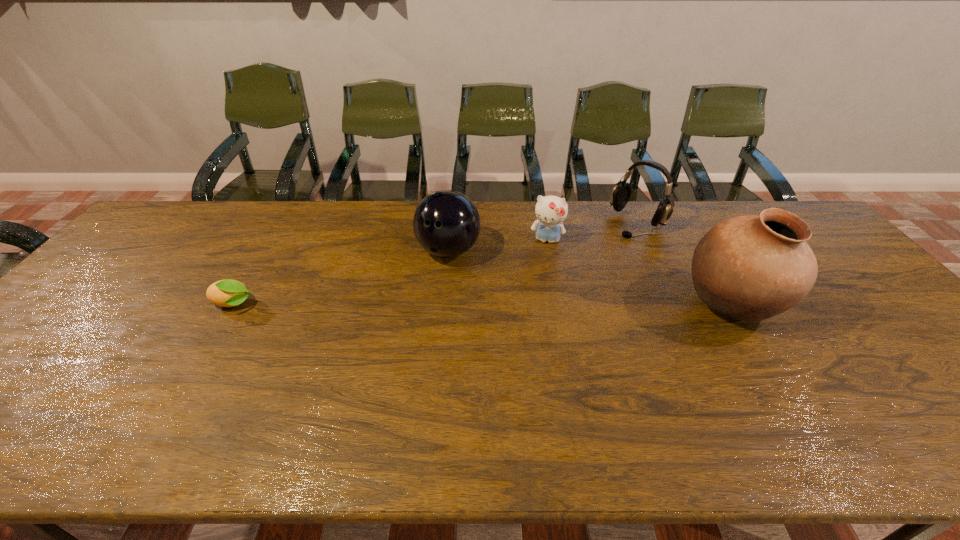
This screenshot has height=540, width=960. What are the coordinates of `bowling ball at the far edge` in the screenshot? It's located at (446, 223).

Where is `vacant region at the far edge of the desktop`? This screenshot has width=960, height=540. vacant region at the far edge of the desktop is located at coordinates (241, 218).

The height and width of the screenshot is (540, 960). Identify the location of vacant space at the near edge. (401, 377).

Where is `free space at the left edge`? free space at the left edge is located at coordinates (102, 272).

Find the location of a particular element. vacant position at the right edge of the desktop is located at coordinates (883, 301).

At what (x,y) coordinates should I click in order to perform the action: click on vacant space at the far left corner of the desktop. Please return your answer as a coordinate pair (x, y). Looking at the image, I should click on (189, 204).

Where is `vacant region at the near left corner of the desktop`? The image size is (960, 540). vacant region at the near left corner of the desktop is located at coordinates (6, 399).

At what (x,y) coordinates should I click in order to perform the action: click on vacant space in between the headset and the lemon. Please return your answer as a coordinate pair (x, y). The image size is (960, 540). Looking at the image, I should click on (436, 264).

The height and width of the screenshot is (540, 960). In order to click on free point between the tallest object and the lemon in this screenshot , I will do `click(483, 305)`.

The width and height of the screenshot is (960, 540). In order to click on vacant point located between the pottery and the headset in this screenshot , I will do `click(684, 264)`.